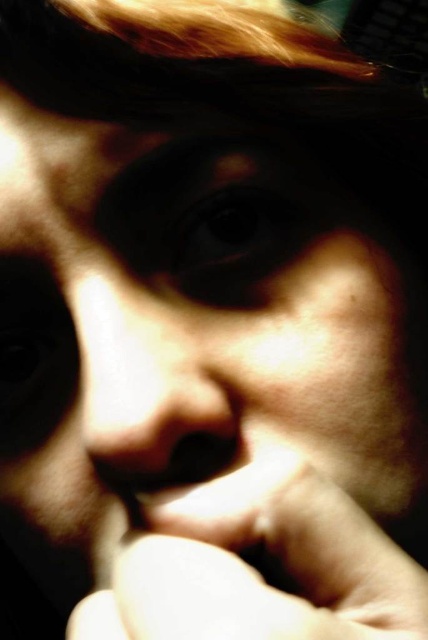
You are a photographer using a camera with a 10 cm focal length. You want to take a close portrait of the smooth skin hand at center. What is the minimum distance you should place the camera from the hand to ensure it is in focus?

The smooth skin hand at center is 5.65 inches away from the viewer. Converting inches to centimeters, 5.65 inches is approximately 14.35 cm. Since the camera has a 10 cm focal length, the minimum distance should be slightly more than 14.35 cm to ensure the hand is in focus.

You are a photographer adjusting the focus of your camera. You notice two points in the image at coordinates point (180,596) and point (130,410). Which point should you focus on to ensure the subject appears sharp in the final photo?

You should focus on point (180,596) because it is closer to the camera and will appear sharper in the photo.

You are an artist trying to sketch this person. You need to decide which object to draw first based on their size. According to the image, which of the following is wider, the smooth skin hand at center or the smooth skin nose at center?

The smooth skin hand at center is wider than the smooth skin nose at center, so you should draw the smooth skin hand at center first since it is wider.